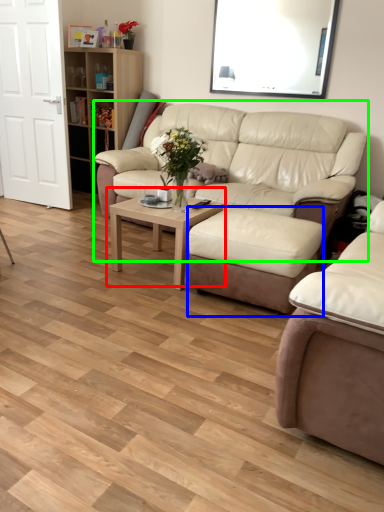
Question: Estimate the real-world distances between objects in this image. Which object is farther from coffee table (highlighted by a red box), stool (highlighted by a blue box) or studio couch (highlighted by a green box)?

Choices:
 (A) stool
 (B) studio couch

Answer: (B)